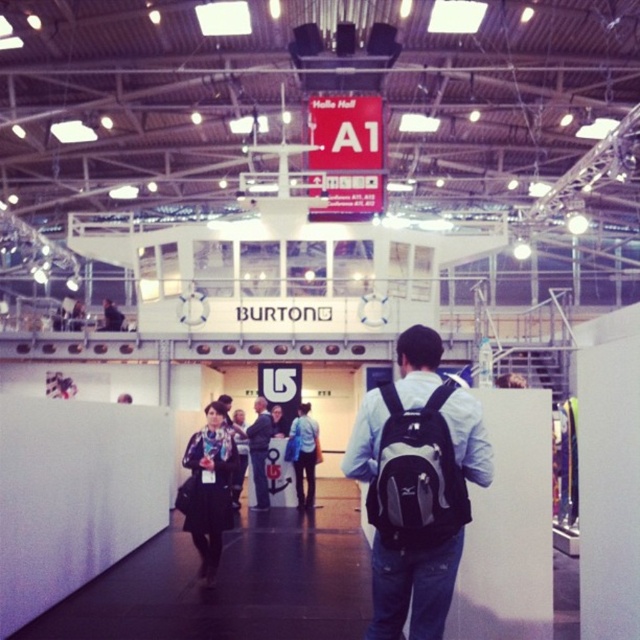
Does patterned scarf at center appear under blue fabric jacket at center?

No.

The width and height of the screenshot is (640, 640). Describe the element at coordinates (209, 486) in the screenshot. I see `patterned scarf at center` at that location.

This screenshot has width=640, height=640. Describe the element at coordinates (209, 486) in the screenshot. I see `patterned scarf at center` at that location.

Find the location of a particular element. The height and width of the screenshot is (640, 640). patterned scarf at center is located at coordinates (209, 486).

Is blue fabric jacket at center wider than dark blue jeans at center?

Yes.

Identify the location of blue fabric jacket at center. (305, 454).

Is gray fabric backpack at center above dark blue jeans at center?

Yes, gray fabric backpack at center is above dark blue jeans at center.

What do you see at coordinates (417, 476) in the screenshot? The height and width of the screenshot is (640, 640). I see `gray fabric backpack at center` at bounding box center [417, 476].

Does point (429, 458) come farther from viewer compared to point (250, 426)?

No, it is in front of (250, 426).

Where is `gray fabric backpack at center`? gray fabric backpack at center is located at coordinates (417, 476).